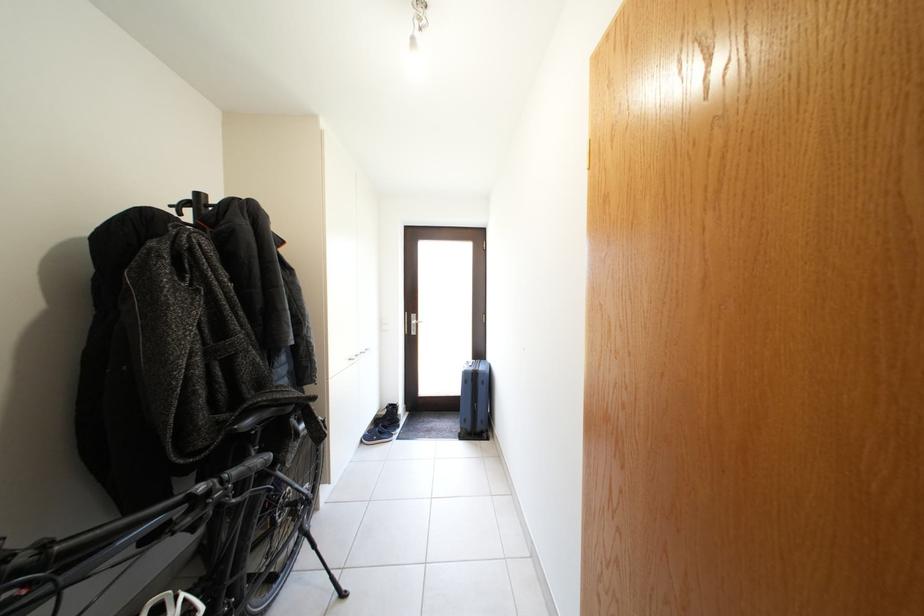
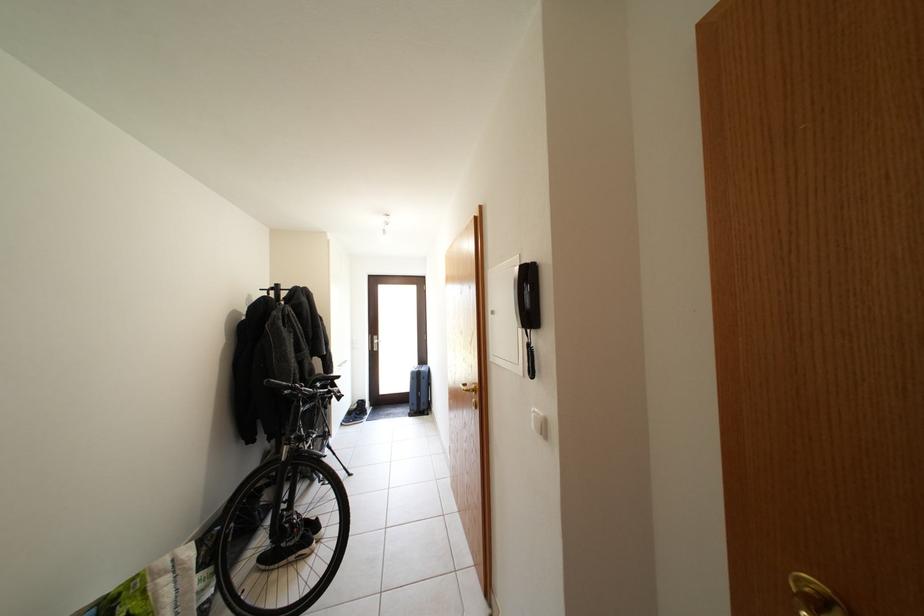
Where in the second image is the point corresponding to (x=473, y=379) from the first image?

(420, 379)